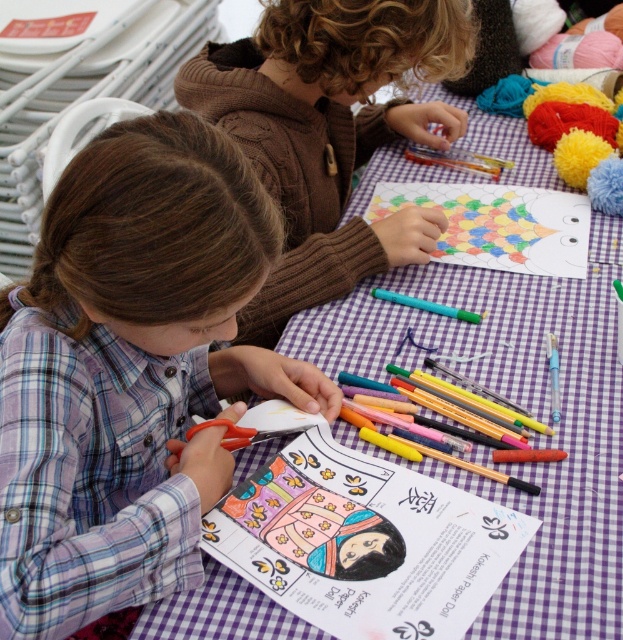
This screenshot has width=623, height=640. What do you see at coordinates (364, 541) in the screenshot? I see `colored paper drawing at center` at bounding box center [364, 541].

Does point (388, 529) come in front of point (386, 294)?

Yes, point (388, 529) is in front of point (386, 294).

This screenshot has width=623, height=640. Find the location of `colored paper drawing at center`. colored paper drawing at center is located at coordinates (364, 541).

Which is behind, point (483, 296) or point (449, 310)?

Positioned behind is point (483, 296).

Is purple checkered tablecloth at center positioned before green matte marker at center?

Yes, purple checkered tablecloth at center is closer to the viewer.

Image resolution: width=623 pixels, height=640 pixels. In order to click on purple checkered tablecloth at center in this screenshot , I will do `click(518, 403)`.

Identify the location of purple checkered tablecloth at center. The image size is (623, 640). (518, 403).

Which is behind, point (402, 116) or point (435, 305)?

Point (402, 116)

Is brown knitted sweater at upper center to the right of green matte marker at center from the viewer's perspective?

In fact, brown knitted sweater at upper center is to the left of green matte marker at center.

At what (x,y) coordinates should I click in order to perform the action: click on brown knitted sweater at upper center. Please return your answer as a coordinate pair (x, y). This screenshot has width=623, height=640. Looking at the image, I should click on (328, 131).